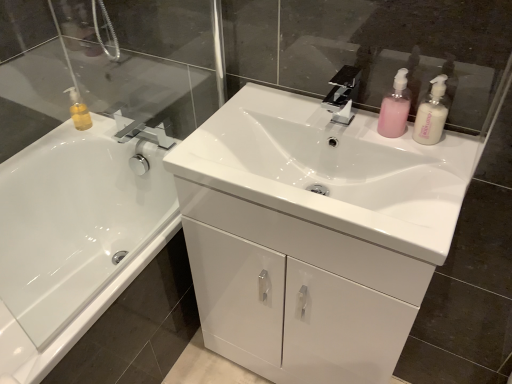
This screenshot has height=384, width=512. In order to click on vacant area that is in front of pink plastic pump bottle at upper right, arranged as the 3th toiletry when viewed from the left in this screenshot , I will do point(439,173).